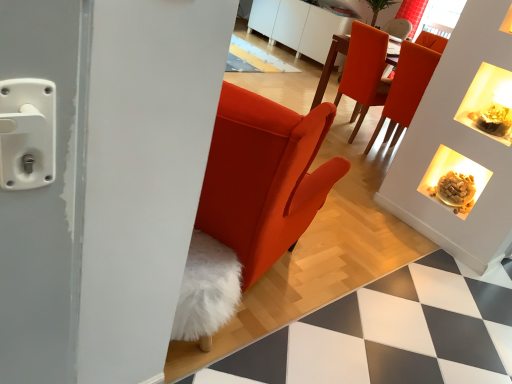
Question: Is matte white fireplace at upper right not near matte orange chair at upper right, which appears as the first chair when viewed from the right?

Choices:
 (A) no
 (B) yes

Answer: (A)

Question: From a real-world perspective, is matte white fireplace at upper right positioned over matte orange chair at upper right, which ranks as the second chair in left-to-right order, based on gravity?

Choices:
 (A) yes
 (B) no

Answer: (B)

Question: Are matte white fireplace at upper right and matte orange chair at upper right, which appears as the first chair when viewed from the right, beside each other?

Choices:
 (A) no
 (B) yes

Answer: (A)

Question: From the image's perspective, is matte white fireplace at upper right beneath matte orange chair at upper right, which appears as the first chair when viewed from the right?

Choices:
 (A) yes
 (B) no

Answer: (A)

Question: Considering the relative positions of matte white fireplace at upper right and matte orange chair at upper right, which ranks as the second chair in left-to-right order, in the image provided, is matte white fireplace at upper right in front of matte orange chair at upper right, which ranks as the second chair in left-to-right order,?

Choices:
 (A) no
 (B) yes

Answer: (B)

Question: Would you say matte white fireplace at upper right is outside matte orange chair at upper right, which appears as the first chair when viewed from the right?

Choices:
 (A) no
 (B) yes

Answer: (B)

Question: Considering the relative sizes of matte orange chair at upper right, which appears as the first chair when viewed from the right, and red velvet curtain at upper center in the image provided, is matte orange chair at upper right, which appears as the first chair when viewed from the right, smaller than red velvet curtain at upper center?

Choices:
 (A) yes
 (B) no

Answer: (B)

Question: From a real-world perspective, is matte orange chair at upper right, which ranks as the second chair in left-to-right order, located higher than red velvet curtain at upper center?

Choices:
 (A) yes
 (B) no

Answer: (B)

Question: From a real-world perspective, is matte orange chair at upper right, which ranks as the second chair in left-to-right order, positioned under red velvet curtain at upper center based on gravity?

Choices:
 (A) no
 (B) yes

Answer: (B)

Question: Is matte orange chair at upper right, which ranks as the second chair in left-to-right order, positioned in front of red velvet curtain at upper center?

Choices:
 (A) no
 (B) yes

Answer: (B)

Question: Can you confirm if matte orange chair at upper right, which appears as the first chair when viewed from the right, is bigger than red velvet curtain at upper center?

Choices:
 (A) yes
 (B) no

Answer: (A)

Question: Does matte orange chair at upper right, which ranks as the second chair in left-to-right order, lie behind red velvet curtain at upper center?

Choices:
 (A) no
 (B) yes

Answer: (A)

Question: Considering the relative sizes of red velvet curtain at upper center and matte white fireplace at upper right in the image provided, is red velvet curtain at upper center taller than matte white fireplace at upper right?

Choices:
 (A) no
 (B) yes

Answer: (B)